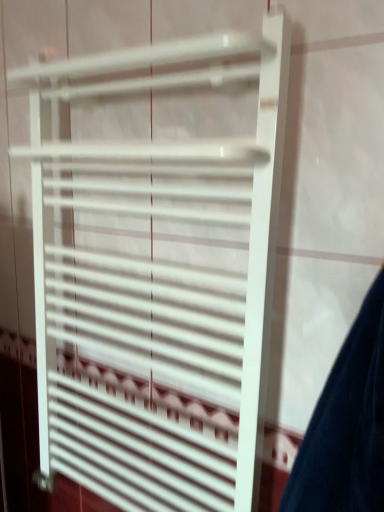
Question: Should I look upward or downward to see white matte radiator at center?

Choices:
 (A) down
 (B) up

Answer: (B)